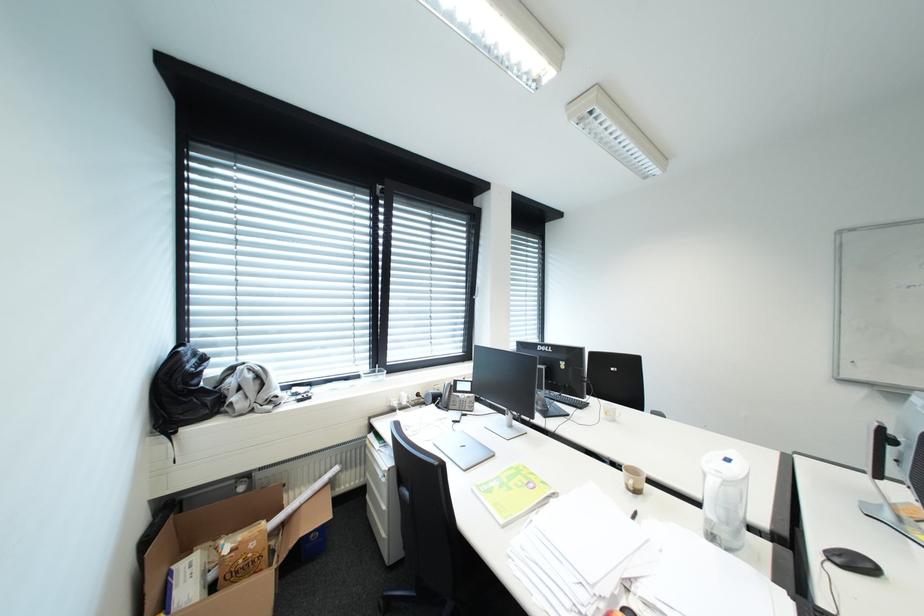
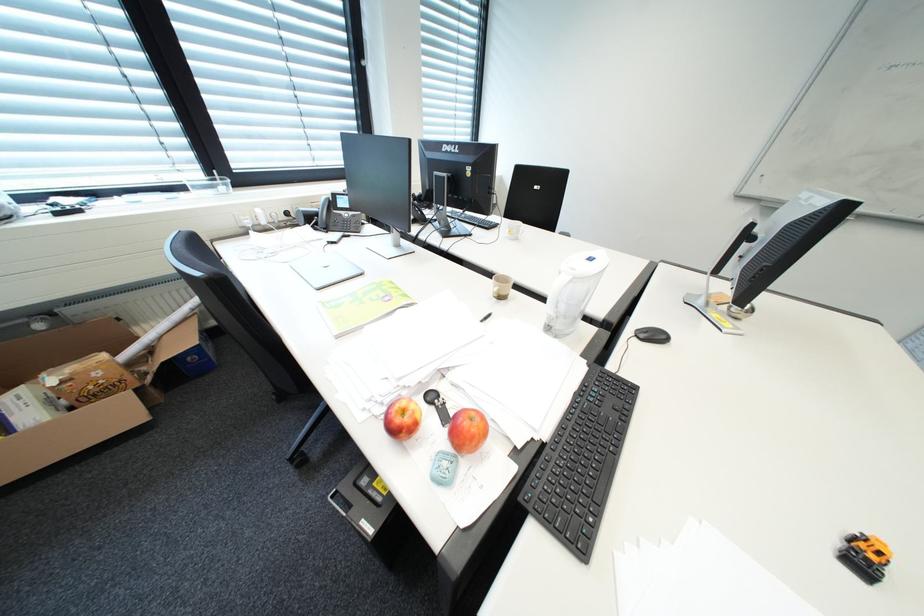
Question: The first image is from the beginning of the video and the second image is from the end. How did the camera likely rotate when shooting the video?

Choices:
 (A) Left
 (B) Right
 (C) Up
 (D) Down

Answer: (D)